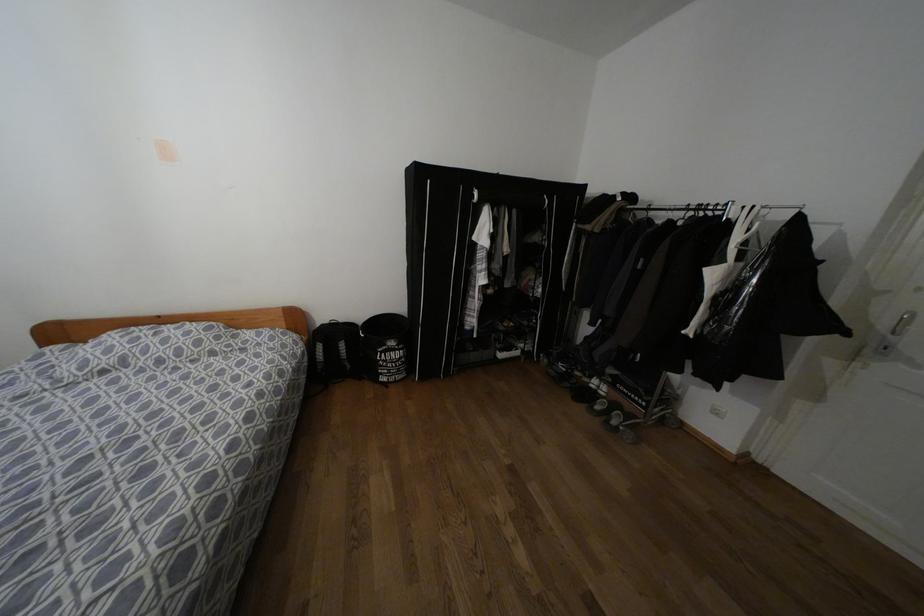
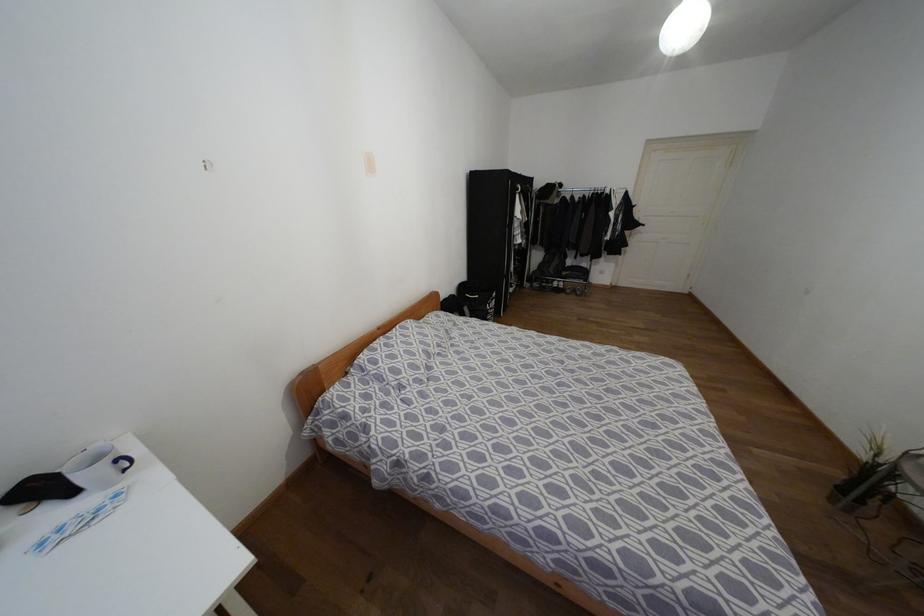
In the second image, find the point that corresponds to (x=391, y=342) in the first image.

(493, 294)